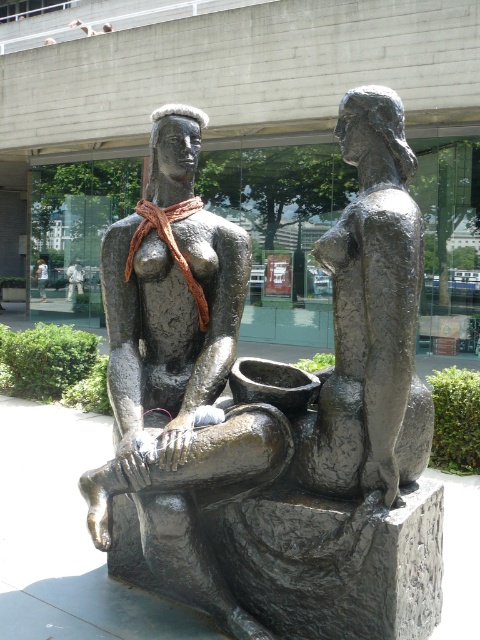
What are the coordinates of the bronze statue at center?

The bronze statue at center is located at coordinates point (276,419).